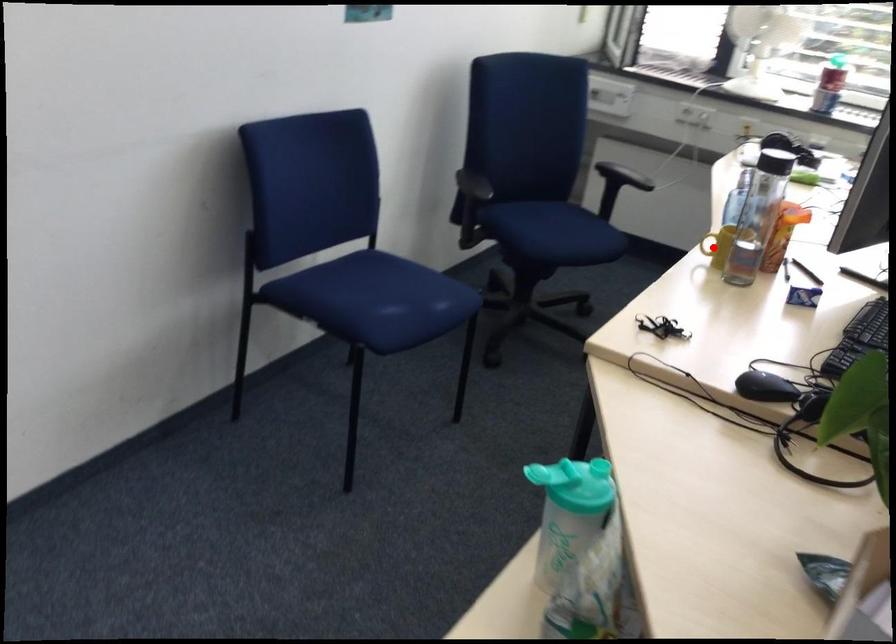
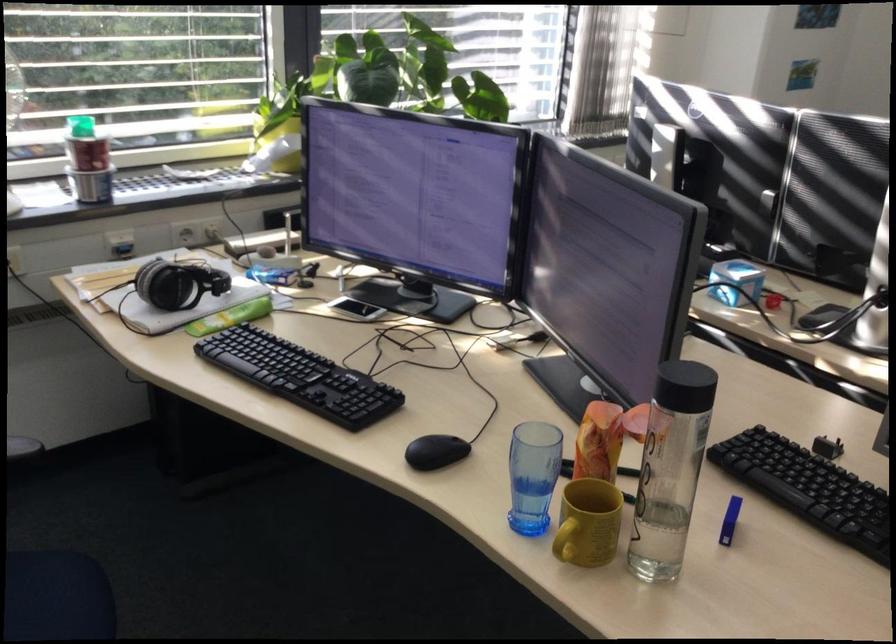
Where in the second image is the point corresponding to the highlighted location from the first image?

(564, 547)